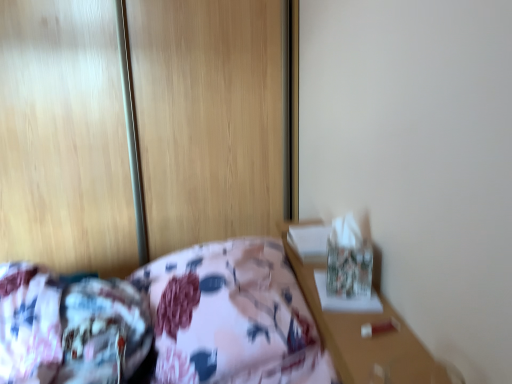
Question: From a real-world perspective, relative to floral fabric mattress at lower left, is floral fabric bed at center vertically above or below?

Choices:
 (A) above
 (B) below

Answer: (B)

Question: From their relative heights in the image, would you say floral fabric bed at center is taller or shorter than floral fabric mattress at lower left?

Choices:
 (A) tall
 (B) short

Answer: (A)

Question: In terms of width, does floral fabric bed at center look wider or thinner when compared to floral fabric mattress at lower left?

Choices:
 (A) wide
 (B) thin

Answer: (A)

Question: From a real-world perspective, relative to floral fabric bed at center, is floral fabric mattress at lower left vertically above or below?

Choices:
 (A) below
 (B) above

Answer: (B)

Question: Is floral fabric mattress at lower left inside or outside of floral fabric bed at center?

Choices:
 (A) inside
 (B) outside

Answer: (A)

Question: Is floral fabric mattress at lower left to the left or to the right of floral fabric bed at center in the image?

Choices:
 (A) right
 (B) left

Answer: (B)

Question: From the image's perspective, relative to floral fabric bed at center, is floral fabric mattress at lower left above or below?

Choices:
 (A) below
 (B) above

Answer: (A)